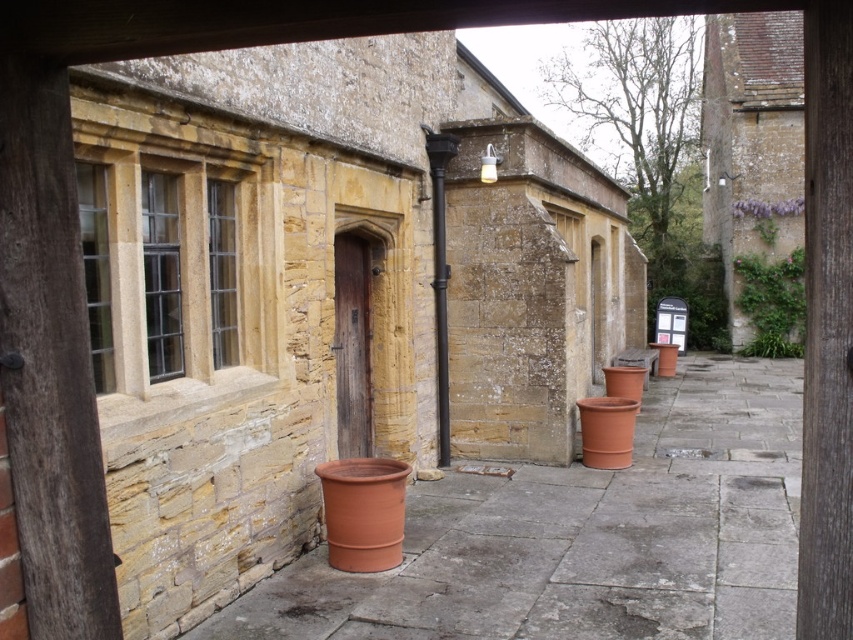
Question: Which point appears closest to the camera in this image?

Choices:
 (A) (735, 300)
 (B) (421, 560)

Answer: (B)

Question: Can you confirm if terracotta clay pot at center is wider than green leafy plant at upper right?

Choices:
 (A) no
 (B) yes

Answer: (B)

Question: Is terracotta clay pot at center smaller than green leafy plant at upper right?

Choices:
 (A) yes
 (B) no

Answer: (B)

Question: Which point is closer to the camera?

Choices:
 (A) green leafy plant at upper right
 (B) terracotta clay pot at center

Answer: (B)

Question: Considering the relative positions of terracotta clay pot at center and green leafy plant at upper right in the image provided, where is terracotta clay pot at center located with respect to green leafy plant at upper right?

Choices:
 (A) left
 (B) right

Answer: (A)

Question: Which point appears closest to the camera in this image?

Choices:
 (A) (288, 564)
 (B) (740, 353)

Answer: (A)